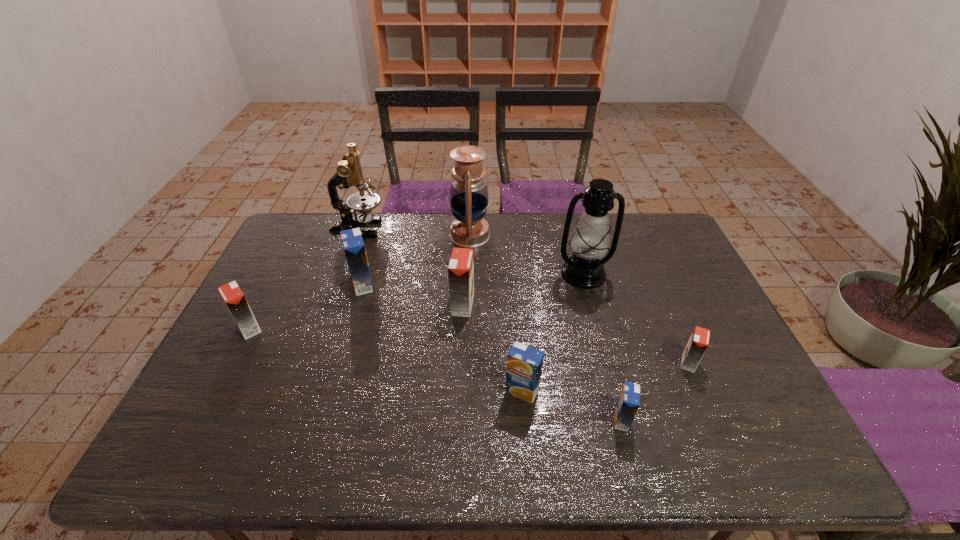
You are a GUI agent. You are given a task and a screenshot of the screen. Output one action in this format:
    pyautogui.click(x=<x>, y=<y>)
    Task: Click on the sixth farthest object
    The width and height of the screenshot is (960, 540).
    Given the screenshot: What is the action you would take?
    pyautogui.click(x=232, y=295)

I want to click on the fourth orange_juice from left to right, so click(524, 364).

Identify the location of the second blue orange_juice from left to right. The height and width of the screenshot is (540, 960). (524, 364).

Find the location of a particular element. Image resolution: width=960 pixels, height=540 pixels. the smallest orange orange juice is located at coordinates (699, 340).

Image resolution: width=960 pixels, height=540 pixels. What are the coordinates of `the third nearest object` in the screenshot? It's located at (699, 340).

You are a GUI agent. You are given a task and a screenshot of the screen. Output one action in this format:
    pyautogui.click(x=<x>, y=<y>)
    Task: Click on the nearest object
    
    Given the screenshot: What is the action you would take?
    pyautogui.click(x=628, y=403)

At what (x,y) coordinates should I click in order to perform the action: click on the rightmost blue orange_juice. Please return your answer as a coordinate pair (x, y). The width and height of the screenshot is (960, 540). Looking at the image, I should click on (628, 403).

Where is `free space located at the eyepiece of the microscope`? free space located at the eyepiece of the microscope is located at coordinates (399, 229).

Locate an element on the screen. This screenshot has width=960, height=540. vacant position located 0.250m on the front of the left oil lamp is located at coordinates (468, 307).

You are a GUI agent. You are given a task and a screenshot of the screen. Output one action in this format:
    pyautogui.click(x=<x>, y=<y>)
    Task: Click on the vacant space situated 0.090m on the right of the black oil lamp
    
    Given the screenshot: What is the action you would take?
    pyautogui.click(x=638, y=274)